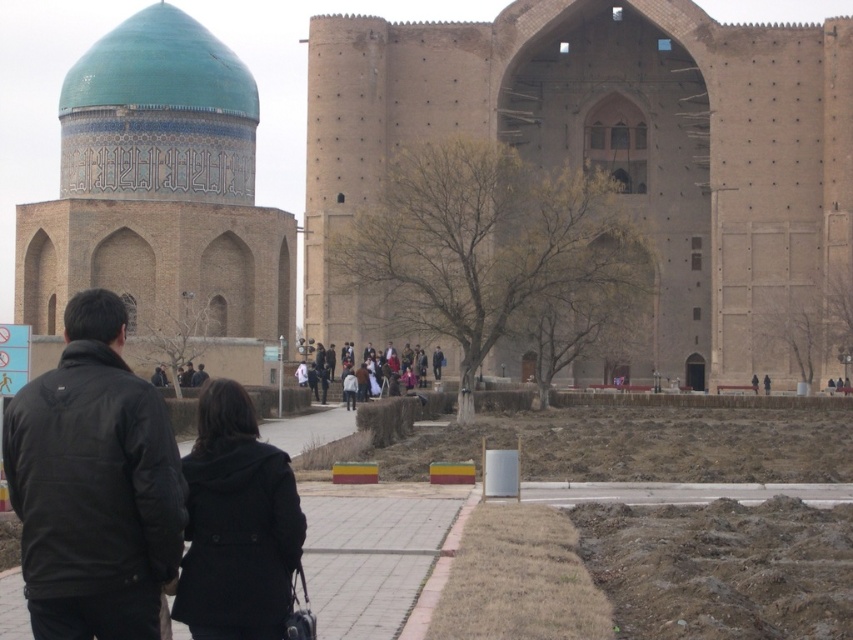
You are standing at the camera position and want to walk towards the historic complex. There are two points marked in the scene. Which point, point (57, 435) or point (263, 602), is closer to you as you start walking?

Point (57, 435) is closer to you because it is in front of point (263, 602).

You are a tourist standing at the entrance of the historic complex and see both the black softshell jacket at lower left and the black matte jacket at center. Which jacket is nearer to you?

The black softshell jacket at lower left is closer to the viewer than the black matte jacket at center.

You are a photographer trying to capture both the black wool coat at center and the black matte jacket at center in the same frame. Since both are moving towards the dome, which object should you focus on first to ensure both fit in the frame?

The black wool coat at center is bigger than the black matte jacket at center, so you should focus on the black wool coat at center first to ensure it fits in the frame, allowing space for the smaller jacket as well.